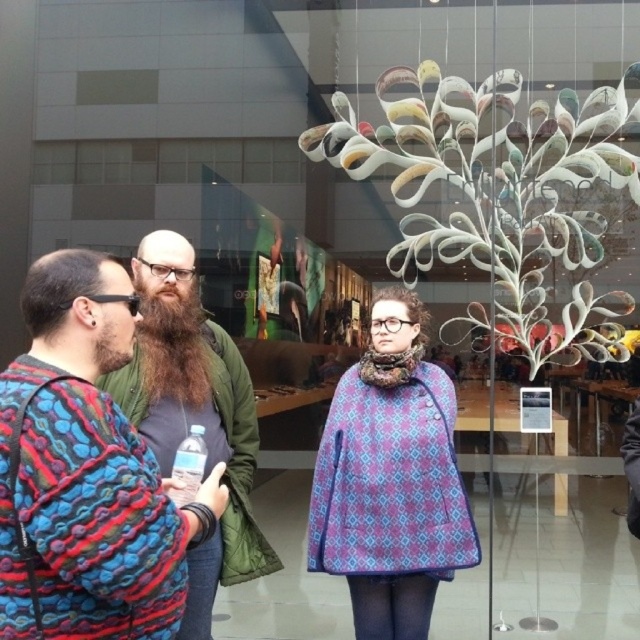
Question: Which point is closer to the camera?

Choices:
 (A) purple printed cape at center
 (B) clear plastic bottle at center
 (C) multicolored knitted sweater at left

Answer: (C)

Question: Can you confirm if green quilted jacket at center is positioned below brownwoodybeard at center?

Choices:
 (A) yes
 (B) no

Answer: (A)

Question: Does multicolored knitted sweater at left have a greater width compared to green quilted jacket at center?

Choices:
 (A) no
 (B) yes

Answer: (A)

Question: Among these objects, which one is farthest from the camera?

Choices:
 (A) clear plastic bottle at center
 (B) brownwoodybeard at center

Answer: (B)

Question: Does purple printed cape at center have a lesser width compared to green quilted jacket at center?

Choices:
 (A) yes
 (B) no

Answer: (B)

Question: Which point is farther to the camera?

Choices:
 (A) green quilted jacket at center
 (B) brownwoodybeard at center

Answer: (B)